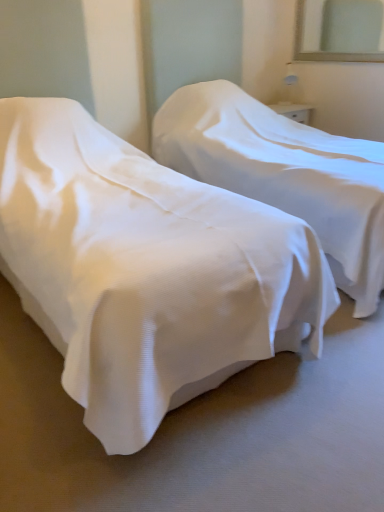
Question: Is white fabric bed at center, which is the first bed in left-to-right order, facing away from white fabric bed at center, marked as the 1th bed in a right-to-left arrangement?

Choices:
 (A) no
 (B) yes

Answer: (A)

Question: Is white fabric bed at center, which is the first bed in left-to-right order, further to the viewer compared to white fabric bed at center, marked as the 1th bed in a right-to-left arrangement?

Choices:
 (A) yes
 (B) no

Answer: (B)

Question: Considering the relative sizes of white fabric bed at center, which is the first bed in left-to-right order, and white fabric bed at center, acting as the 2th bed starting from the left, in the image provided, is white fabric bed at center, which is the first bed in left-to-right order, taller than white fabric bed at center, acting as the 2th bed starting from the left,?

Choices:
 (A) yes
 (B) no

Answer: (B)

Question: Is white fabric bed at center, which is the first bed in left-to-right order, beside white fabric bed at center, marked as the 1th bed in a right-to-left arrangement?

Choices:
 (A) yes
 (B) no

Answer: (B)

Question: Does white fabric bed at center, which is the first bed in left-to-right order, have a lesser width compared to white fabric bed at center, marked as the 1th bed in a right-to-left arrangement?

Choices:
 (A) no
 (B) yes

Answer: (A)

Question: Is clear glass mirror at upper right spatially inside white fabric bed at center, which is the first bed in left-to-right order, or outside of it?

Choices:
 (A) inside
 (B) outside

Answer: (B)

Question: From a real-world perspective, relative to white fabric bed at center, the second bed viewed from the right, is clear glass mirror at upper right vertically above or below?

Choices:
 (A) above
 (B) below

Answer: (A)

Question: Considering the relative positions of clear glass mirror at upper right and white fabric bed at center, the second bed viewed from the right, in the image provided, is clear glass mirror at upper right to the left or to the right of white fabric bed at center, the second bed viewed from the right,?

Choices:
 (A) left
 (B) right

Answer: (B)

Question: Relative to white fabric bed at center, which is the first bed in left-to-right order, is clear glass mirror at upper right in front or behind?

Choices:
 (A) front
 (B) behind

Answer: (B)

Question: Is white fabric bed at center, the second bed viewed from the right, taller or shorter than clear glass mirror at upper right?

Choices:
 (A) tall
 (B) short

Answer: (A)

Question: Looking at the image, does white fabric bed at center, the second bed viewed from the right, seem bigger or smaller compared to clear glass mirror at upper right?

Choices:
 (A) big
 (B) small

Answer: (A)

Question: Based on their positions, is white fabric bed at center, which is the first bed in left-to-right order, located to the left or right of clear glass mirror at upper right?

Choices:
 (A) right
 (B) left

Answer: (B)

Question: From a real-world perspective, is white fabric bed at center, which is the first bed in left-to-right order, positioned above or below clear glass mirror at upper right?

Choices:
 (A) above
 (B) below

Answer: (B)

Question: Looking at their shapes, would you say white fabric bed at center, the second bed viewed from the right, is wider or thinner than white fabric bed at center, marked as the 1th bed in a right-to-left arrangement?

Choices:
 (A) thin
 (B) wide

Answer: (B)

Question: From a real-world perspective, is white fabric bed at center, the second bed viewed from the right, above or below white fabric bed at center, acting as the 2th bed starting from the left?

Choices:
 (A) above
 (B) below

Answer: (B)